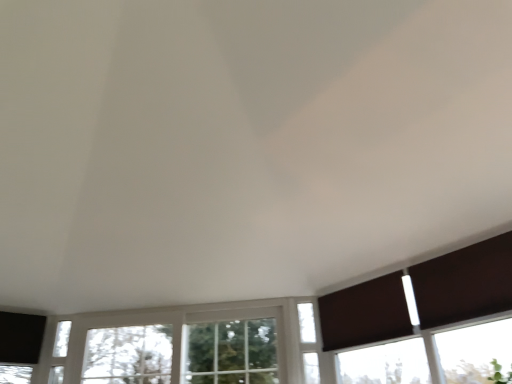
Question: Should I look upward or downward to see white glass window at lower left, marked as the third window in a right-to-left arrangement?

Choices:
 (A) down
 (B) up

Answer: (A)

Question: Is brown matte shutter at right inside white glass window at lower left, which is the 1th window in left-to-right order?

Choices:
 (A) no
 (B) yes

Answer: (A)

Question: Is white glass window at lower left, which is the 1th window in left-to-right order, taller than brown matte shutter at right?

Choices:
 (A) yes
 (B) no

Answer: (A)

Question: Is white glass window at lower left, which is the 1th window in left-to-right order, positioned before brown matte shutter at right?

Choices:
 (A) no
 (B) yes

Answer: (A)

Question: From a real-world perspective, is white glass window at lower left, marked as the third window in a right-to-left arrangement, under brown matte shutter at right?

Choices:
 (A) no
 (B) yes

Answer: (B)

Question: Are white glass window at lower left, which is the 1th window in left-to-right order, and brown matte shutter at right far apart?

Choices:
 (A) yes
 (B) no

Answer: (A)

Question: Considering the relative sizes of white glass window at lower left, which is the 1th window in left-to-right order, and brown matte shutter at right in the image provided, is white glass window at lower left, which is the 1th window in left-to-right order, bigger than brown matte shutter at right?

Choices:
 (A) yes
 (B) no

Answer: (B)

Question: Would you say clear glass window at center, positioned as the second window in right-to-left order, is outside brown fabric curtain at lower right?

Choices:
 (A) yes
 (B) no

Answer: (A)

Question: Does clear glass window at center, marked as the second window in a left-to-right arrangement, have a larger size compared to brown fabric curtain at lower right?

Choices:
 (A) no
 (B) yes

Answer: (B)

Question: From a real-world perspective, is clear glass window at center, positioned as the second window in right-to-left order, under brown fabric curtain at lower right?

Choices:
 (A) yes
 (B) no

Answer: (A)

Question: Considering the relative positions of clear glass window at center, marked as the second window in a left-to-right arrangement, and brown fabric curtain at lower right in the image provided, is clear glass window at center, marked as the second window in a left-to-right arrangement, in front of brown fabric curtain at lower right?

Choices:
 (A) no
 (B) yes

Answer: (A)

Question: Is clear glass window at center, positioned as the second window in right-to-left order, oriented away from brown fabric curtain at lower right?

Choices:
 (A) yes
 (B) no

Answer: (B)

Question: Can you confirm if clear glass window at center, positioned as the second window in right-to-left order, is thinner than brown fabric curtain at lower right?

Choices:
 (A) no
 (B) yes

Answer: (A)

Question: From the image's perspective, does clear glass window at center, positioned as the second window in right-to-left order, appear lower than white glass window at center, which is the 3th window in left-to-right order?

Choices:
 (A) no
 (B) yes

Answer: (B)